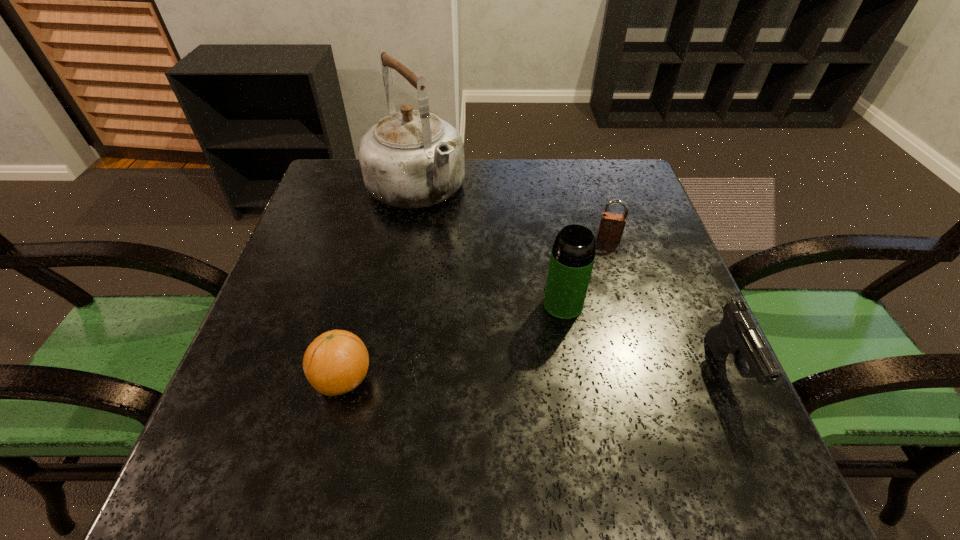
Locate an element on the screen. The image size is (960, 540). orange is located at coordinates (336, 362).

Find the location of a particular element. The height and width of the screenshot is (540, 960). pistol is located at coordinates tap(738, 334).

Find the location of a particular element. padlock is located at coordinates (611, 227).

Find the location of a particular element. Image resolution: width=960 pixels, height=540 pixels. the second object from right to left is located at coordinates (611, 227).

This screenshot has height=540, width=960. Find the location of `the second tallest object`. the second tallest object is located at coordinates (573, 253).

In order to click on thermos bottle in this screenshot , I will do `click(573, 253)`.

The height and width of the screenshot is (540, 960). Identify the location of the tallest object. (410, 159).

You are a GUI agent. You are given a task and a screenshot of the screen. Output one action in this format:
    pyautogui.click(x=<x>, y=<y>)
    Task: Click on the kettle
    This screenshot has height=540, width=960.
    Given the screenshot: What is the action you would take?
    pyautogui.click(x=410, y=159)

Image resolution: width=960 pixels, height=540 pixels. Find the location of `free space located 0.230m on the right of the orange`. free space located 0.230m on the right of the orange is located at coordinates (500, 379).

You are a GUI agent. You are given a task and a screenshot of the screen. Output one action in this format:
    pyautogui.click(x=<x>, y=<y>)
    Task: Click on the blank area located on the front-facing side of the second farthest object
    The height and width of the screenshot is (540, 960).
    Given the screenshot: What is the action you would take?
    pyautogui.click(x=605, y=262)